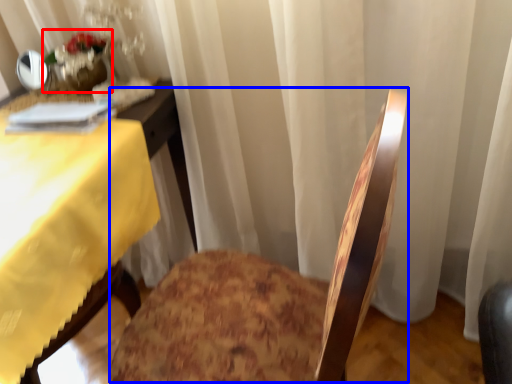
Question: Which of the following is the closest to the observer, floral arrangement (highlighted by a red box) or rocking chair (highlighted by a blue box)?

Choices:
 (A) floral arrangement
 (B) rocking chair

Answer: (B)